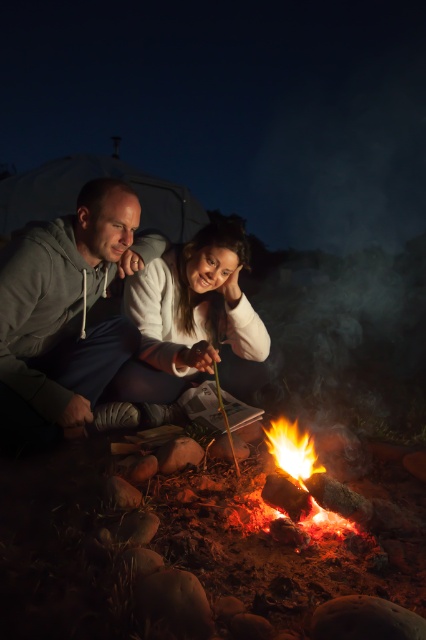
Is gray hoodie at left to the right of flaming wood at center from the viewer's perspective?

Incorrect, gray hoodie at left is not on the right side of flaming wood at center.

At what (x,y) coordinates should I click in order to perform the action: click on gray hoodie at left. Please return your answer as a coordinate pair (x, y). Looking at the image, I should click on (66, 312).

Is white soft sweater at center wider than flaming wood at center?

Yes.

Which is below, white soft sweater at center or flaming wood at center?

Positioned lower is flaming wood at center.

The image size is (426, 640). In order to click on white soft sweater at center in this screenshot , I will do `click(189, 316)`.

Locate an element on the screen. The height and width of the screenshot is (640, 426). white soft sweater at center is located at coordinates (189, 316).

Who is positioned more to the right, gray hoodie at left or white soft sweater at center?

Positioned to the right is white soft sweater at center.

Is gray hoodie at left thinner than white soft sweater at center?

Yes, gray hoodie at left is thinner than white soft sweater at center.

You are a GUI agent. You are given a task and a screenshot of the screen. Output one action in this format:
    pyautogui.click(x=<x>, y=<y>)
    Task: Click on the gray hoodie at left
    This screenshot has width=426, height=640.
    Given the screenshot: What is the action you would take?
    pyautogui.click(x=66, y=312)